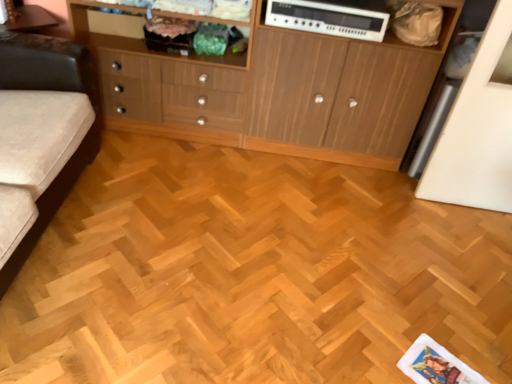
Question: Can you confirm if wooden cabinet at left is positioned to the left of white plastic stereo at upper center?

Choices:
 (A) no
 (B) yes

Answer: (B)

Question: From the image's perspective, is wooden cabinet at left beneath white plastic stereo at upper center?

Choices:
 (A) no
 (B) yes

Answer: (B)

Question: Does wooden cabinet at left contain white plastic stereo at upper center?

Choices:
 (A) no
 (B) yes

Answer: (A)

Question: From the image's perspective, is wooden cabinet at left on top of white plastic stereo at upper center?

Choices:
 (A) no
 (B) yes

Answer: (A)

Question: Does wooden cabinet at left have a greater height compared to white plastic stereo at upper center?

Choices:
 (A) yes
 (B) no

Answer: (A)

Question: In the image, is light brown wood parquet floor at center positioned in front of or behind wooden cabinet at center?

Choices:
 (A) behind
 (B) front

Answer: (B)

Question: Is light brown wood parquet floor at center bigger or smaller than wooden cabinet at center?

Choices:
 (A) small
 (B) big

Answer: (A)

Question: Is light brown wood parquet floor at center inside the boundaries of wooden cabinet at center, or outside?

Choices:
 (A) outside
 (B) inside

Answer: (A)

Question: From a real-world perspective, is light brown wood parquet floor at center above or below wooden cabinet at center?

Choices:
 (A) above
 (B) below

Answer: (B)

Question: Is point (241, 54) positioned closer to the camera than point (221, 152)?

Choices:
 (A) farther
 (B) closer

Answer: (B)

Question: Which is correct: wooden cabinet at left is inside light brown wood parquet floor at center, or outside of it?

Choices:
 (A) inside
 (B) outside

Answer: (B)

Question: Is wooden cabinet at left to the left or to the right of light brown wood parquet floor at center in the image?

Choices:
 (A) left
 (B) right

Answer: (A)

Question: Is wooden cabinet at left wider or thinner than light brown wood parquet floor at center?

Choices:
 (A) thin
 (B) wide

Answer: (A)

Question: In the image, is wooden cabinet at center on the left side or the right side of white plastic stereo at upper center?

Choices:
 (A) right
 (B) left

Answer: (A)

Question: In terms of size, does wooden cabinet at center appear bigger or smaller than white plastic stereo at upper center?

Choices:
 (A) small
 (B) big

Answer: (B)